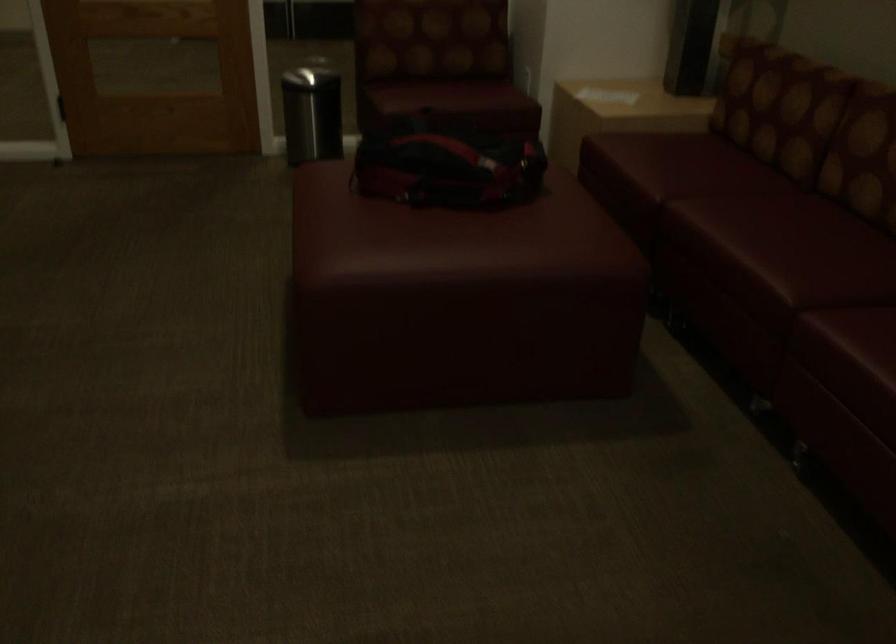
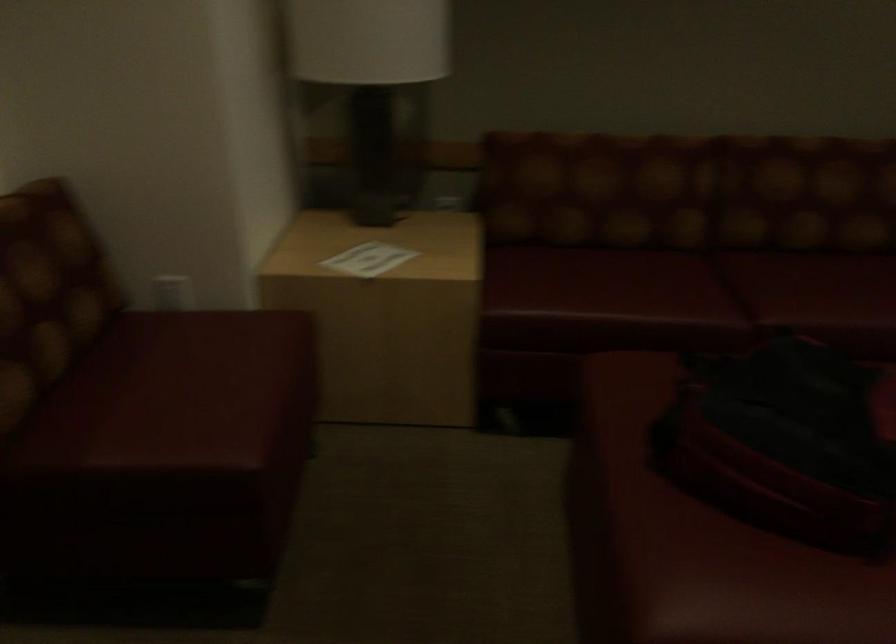
Where in the second image is the point corresponding to (604,88) from the first image?

(367, 259)